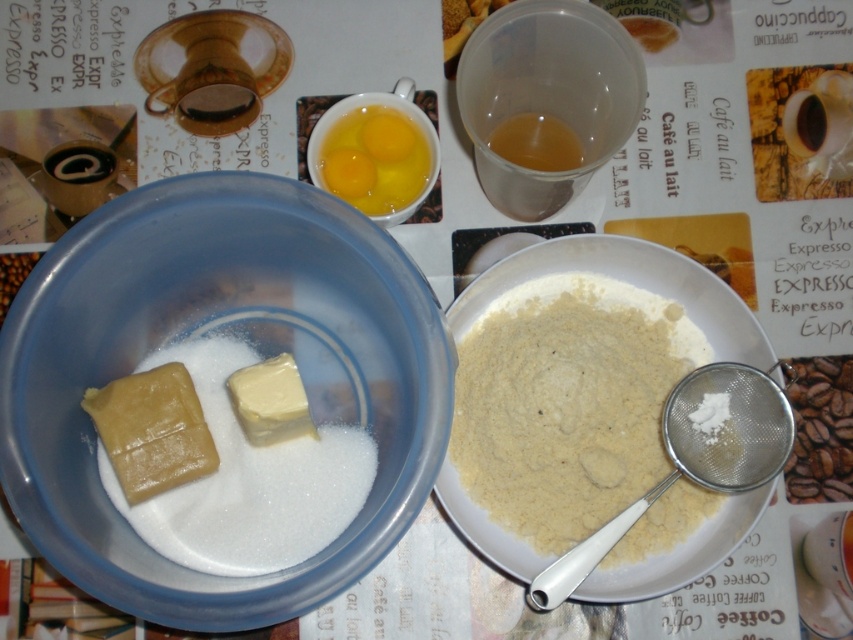
Which is in front, point (113, 516) or point (378, 161)?

Positioned in front is point (113, 516).

Is white plastic bowl at center to the left of yellow/yolkish/egg at upper center from the viewer's perspective?

Yes, white plastic bowl at center is to the left of yellow/yolkish/egg at upper center.

Between point (212, 282) and point (338, 189), which one is positioned in front?

Point (212, 282) is more forward.

The width and height of the screenshot is (853, 640). Find the location of `white plastic bowl at center`. white plastic bowl at center is located at coordinates (227, 332).

How distant is white powdery flour at center from yellow/yolkish/egg at upper center?

white powdery flour at center is 9.91 inches from yellow/yolkish/egg at upper center.

Locate an element on the screen. This screenshot has height=640, width=853. white powdery flour at center is located at coordinates (567, 403).

Is white plastic bowl at center wider than white powder at left?

Yes, white plastic bowl at center is wider than white powder at left.

Is point (198, 260) positioned after point (228, 401)?

No, it is in front of (228, 401).

Is point (115, 248) more distant than point (283, 464)?

No, it is in front of (283, 464).

The width and height of the screenshot is (853, 640). In order to click on white plastic bowl at center in this screenshot , I will do `click(227, 332)`.